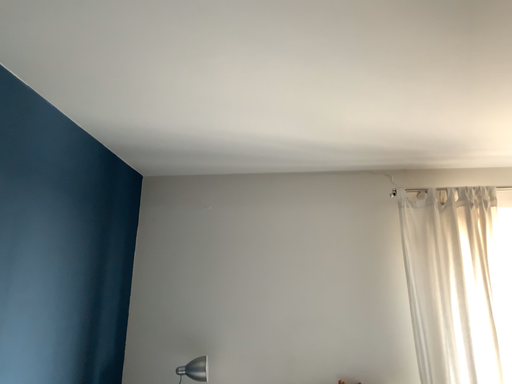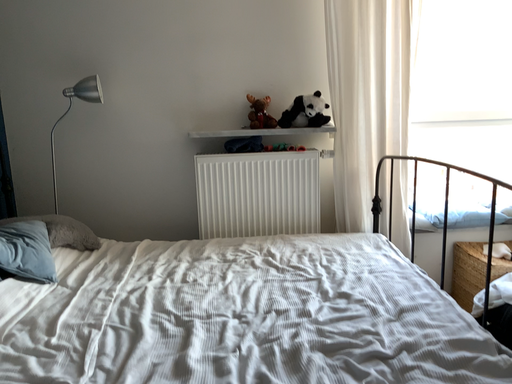
Question: How did the camera likely rotate when shooting the video?

Choices:
 (A) rotated downward
 (B) rotated upward

Answer: (A)